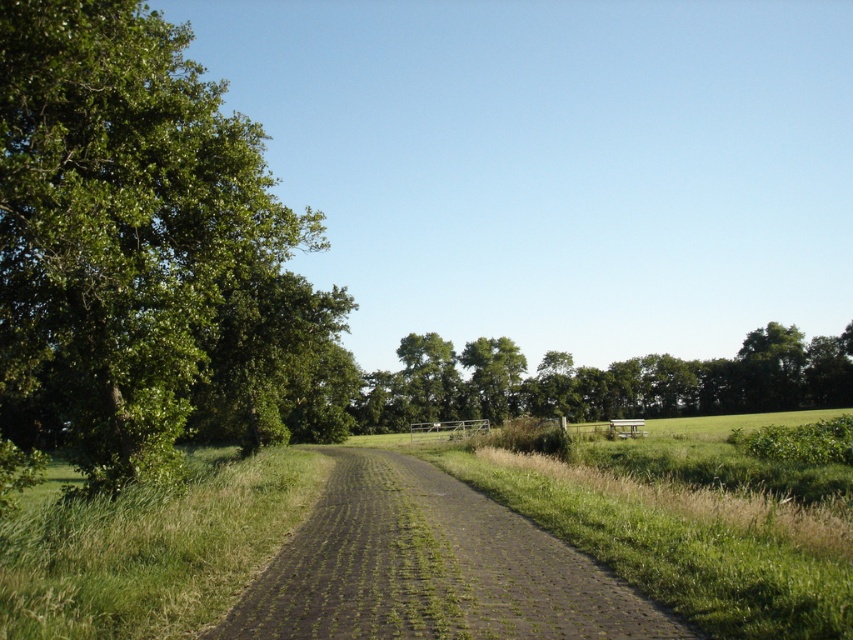
Question: Does dull brown dirt track at center appear over green leafy trees at center?

Choices:
 (A) no
 (B) yes

Answer: (B)

Question: Is dull brown dirt track at center to the left of green leafy tree at center from the viewer's perspective?

Choices:
 (A) no
 (B) yes

Answer: (B)

Question: Which point is closer to the camera?

Choices:
 (A) (352, 406)
 (B) (477, 397)
 (C) (439, 500)

Answer: (C)

Question: Estimate the real-world distances between objects in this image. Which object is farther from the green leafy tree at center?

Choices:
 (A) green leafy trees at center
 (B) green leafy tree at left
 (C) dull brown dirt track at center

Answer: (C)

Question: Is dull brown dirt track at center wider than green leafy trees at center?

Choices:
 (A) no
 (B) yes

Answer: (A)

Question: Among these objects, which one is nearest to the camera?

Choices:
 (A) green leafy tree at left
 (B) green leafy tree at center

Answer: (A)